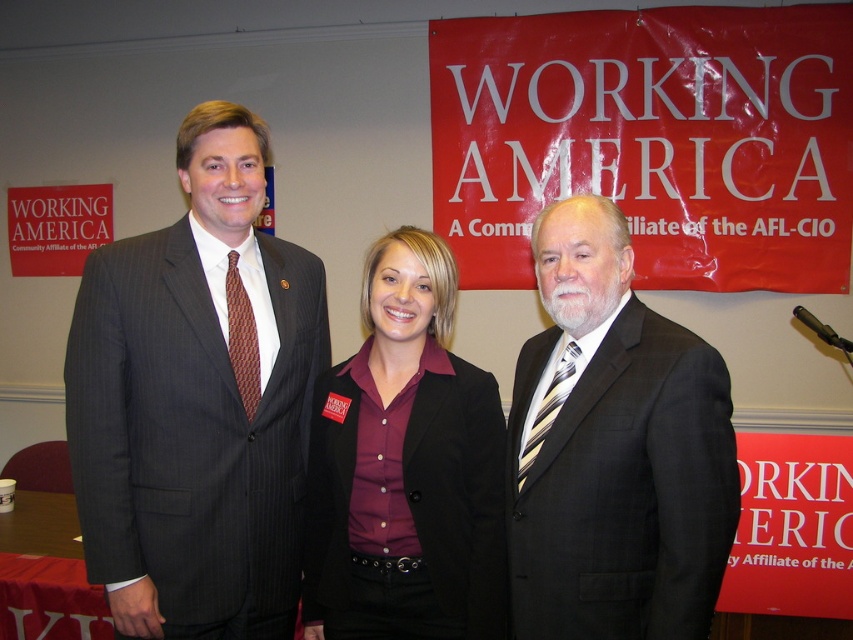
Based on the coordinates provided, which object is located at point (195, 404) in the image?

The gray pinstripe suit at center is located at point (195, 404).

You are a photographer at this event and need to adjust the lighting so that both the matte black blazer at center and the striped silk tie at right are equally illuminated. Given their current positions, which object should you move closer to the light source to achieve this?

The striped silk tie at right should be moved closer to the light source because the matte black blazer at center is 11.95 inches away from it, so moving the tie closer would balance their illumination distances.